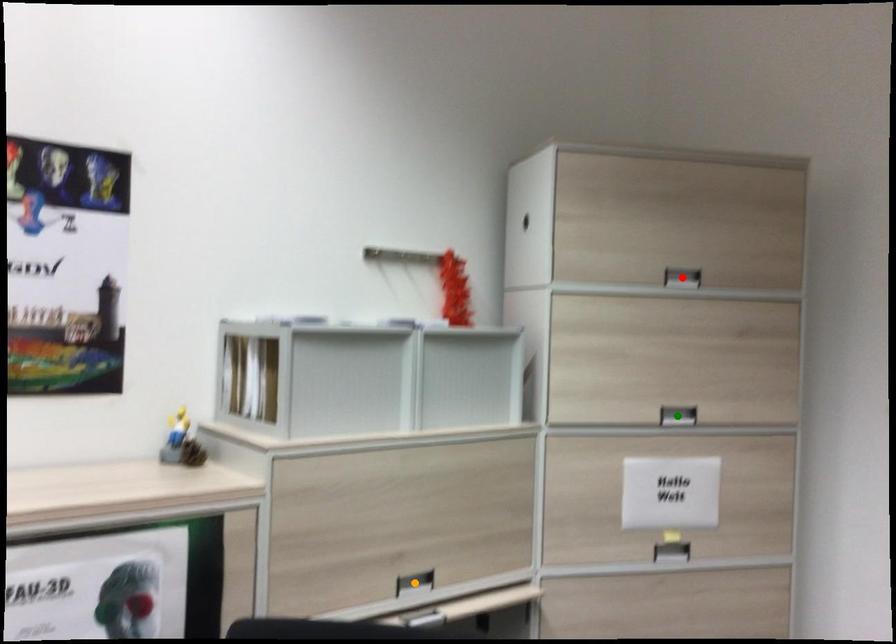
Order these from nearest to farthest:
green point, red point, orange point

orange point < green point < red point